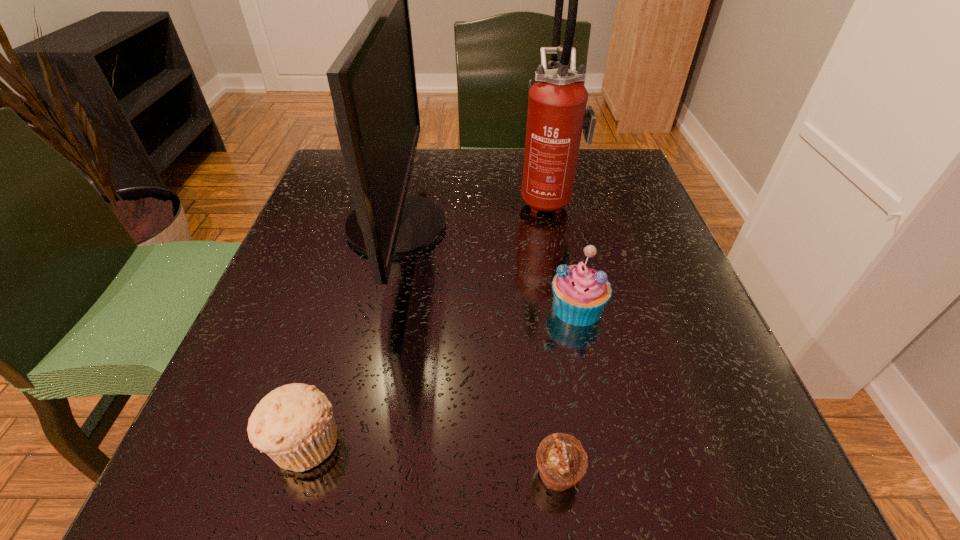
The width and height of the screenshot is (960, 540). What are the coordinates of `vacant space at the near edge of the desktop` in the screenshot? It's located at (436, 511).

Where is `vacant space at the left edge`? This screenshot has width=960, height=540. vacant space at the left edge is located at coordinates (315, 298).

In the image, there is a desktop. Identify the location of free space at the right edge. The width and height of the screenshot is (960, 540). (604, 224).

This screenshot has height=540, width=960. Find the location of `free space at the near left corner`. free space at the near left corner is located at coordinates point(273,477).

You are a GUI agent. You are given a task and a screenshot of the screen. Output one action in this format:
    pyautogui.click(x=<x>, y=<y>)
    Task: Click on the vacant region at the far right corner
    
    Given the screenshot: What is the action you would take?
    pyautogui.click(x=622, y=151)

What are the coordinates of `free region at the near right corner of the desktop` in the screenshot? It's located at (784, 505).

The height and width of the screenshot is (540, 960). I want to click on vacant space that is in between the fire extinguisher and the farthest muffin, so click(563, 253).

The width and height of the screenshot is (960, 540). Find the location of `vacant area that lies between the fire extinguisher and the monitor`. vacant area that lies between the fire extinguisher and the monitor is located at coordinates (472, 212).

Where is `vacant space that's between the fire extinguisher and the farthest muffin`? vacant space that's between the fire extinguisher and the farthest muffin is located at coordinates tap(563, 253).

Identify the location of free space between the monitor and the farthest muffin. This screenshot has width=960, height=540. (487, 267).